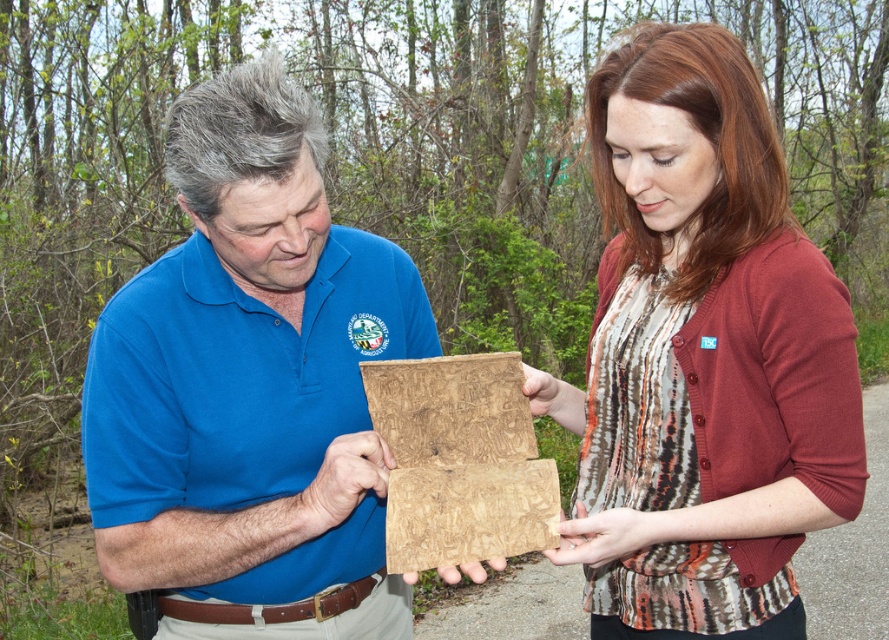
You are standing in the scene and want to place a small sticker on the matte brown wood at center. Based on the coordinates provided, where should you aim to place the sticker?

The matte brown wood at center is located at point (702, 356), so you should aim for those coordinates to place the sticker.